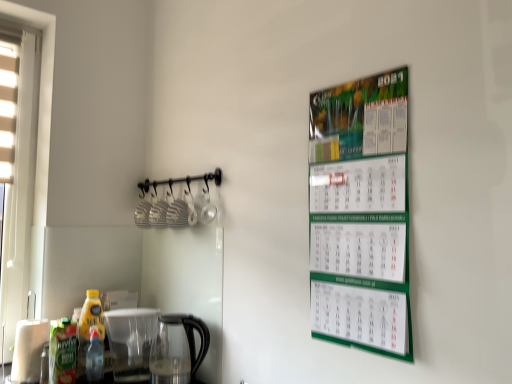
Question: Is green matte calendar at upper right bigger than green matte juice at lower left, the first bottle in the left-to-right sequence?

Choices:
 (A) no
 (B) yes

Answer: (B)

Question: Does green matte calendar at upper right have a greater height compared to green matte juice at lower left, the first bottle in the left-to-right sequence?

Choices:
 (A) no
 (B) yes

Answer: (B)

Question: From the image's perspective, is green matte calendar at upper right located above green matte juice at lower left, the 3th bottle positioned from the right?

Choices:
 (A) no
 (B) yes

Answer: (B)

Question: Does green matte calendar at upper right come in front of green matte juice at lower left, the first bottle in the left-to-right sequence?

Choices:
 (A) no
 (B) yes

Answer: (B)

Question: Are green matte calendar at upper right and green matte juice at lower left, the first bottle in the left-to-right sequence, far apart?

Choices:
 (A) no
 (B) yes

Answer: (B)

Question: Do you think transparent glass coffeepot at lower center is within green matte juice at lower left, the 3th bottle positioned from the right, or outside of it?

Choices:
 (A) outside
 (B) inside

Answer: (A)

Question: Is transparent glass coffeepot at lower center to the left or to the right of green matte juice at lower left, the first bottle in the left-to-right sequence, in the image?

Choices:
 (A) left
 (B) right

Answer: (B)

Question: From the image's perspective, is transparent glass coffeepot at lower center located above or below green matte juice at lower left, the 3th bottle positioned from the right?

Choices:
 (A) below
 (B) above

Answer: (A)

Question: Considering the positions of transparent glass coffeepot at lower center and green matte juice at lower left, the 3th bottle positioned from the right, in the image, is transparent glass coffeepot at lower center bigger or smaller than green matte juice at lower left, the 3th bottle positioned from the right,?

Choices:
 (A) small
 (B) big

Answer: (B)

Question: From a real-world perspective, is transparent glass coffeepot at lower center positioned above or below yellow plastic bottle at lower left, arranged as the 2th bottle when viewed from the left?

Choices:
 (A) above
 (B) below

Answer: (B)

Question: Is transparent glass coffeepot at lower center to the left or to the right of yellow plastic bottle at lower left, acting as the second bottle starting from the right, in the image?

Choices:
 (A) right
 (B) left

Answer: (A)

Question: Does point pyautogui.click(x=190, y=357) appear closer or farther from the camera than point pyautogui.click(x=87, y=291)?

Choices:
 (A) farther
 (B) closer

Answer: (B)

Question: From their relative heights in the image, would you say transparent glass coffeepot at lower center is taller or shorter than yellow plastic bottle at lower left, acting as the second bottle starting from the right?

Choices:
 (A) tall
 (B) short

Answer: (B)

Question: In terms of height, does translucent plastic bottle at lower left, the third bottle from the left, look taller or shorter compared to transparent glass coffeepot at lower center?

Choices:
 (A) tall
 (B) short

Answer: (B)

Question: Considering the positions of translucent plastic bottle at lower left, the third bottle from the left, and transparent glass coffeepot at lower center in the image, is translucent plastic bottle at lower left, the third bottle from the left, wider or thinner than transparent glass coffeepot at lower center?

Choices:
 (A) thin
 (B) wide

Answer: (A)